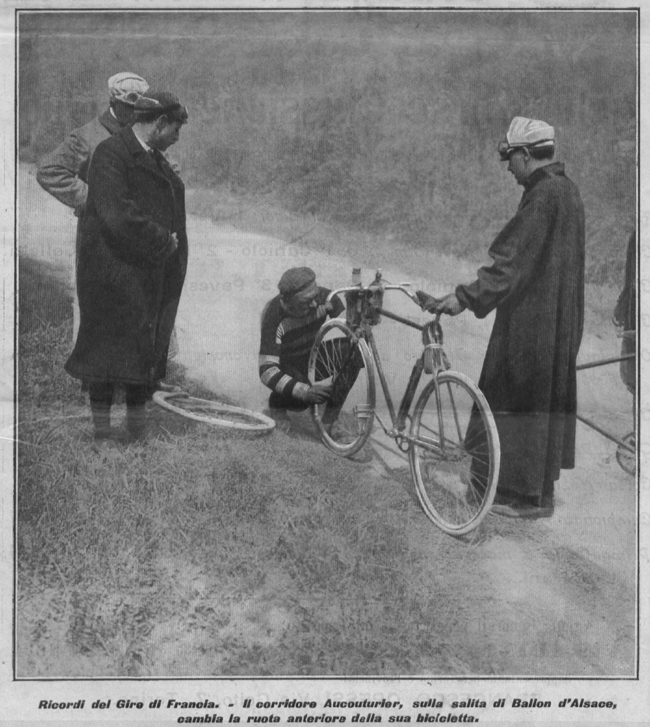
At what (x,y) coordinates should I click in order to perform the action: click on handles. Please return your answer as a coordinate pair (x, y). The width and height of the screenshot is (650, 727). Looking at the image, I should click on (354, 289).